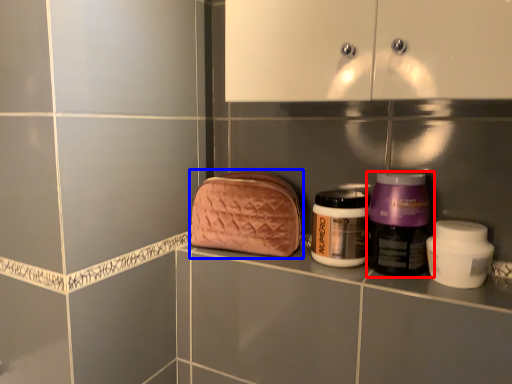
Question: Which point is further to the camera, bottle (highlighted by a red box) or pouch (highlighted by a blue box)?

Choices:
 (A) bottle
 (B) pouch

Answer: (B)